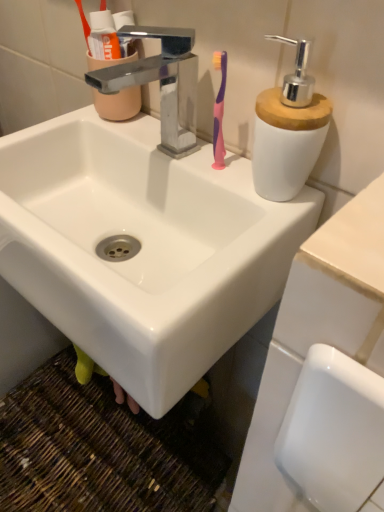
Question: Is satin nickel faucet at center completely or partially inside translucent plastic cup at upper left?

Choices:
 (A) yes
 (B) no

Answer: (B)

Question: From a real-world perspective, is translucent plastic cup at upper left on satin nickel faucet at center?

Choices:
 (A) yes
 (B) no

Answer: (A)

Question: Is translucent plastic cup at upper left completely or partially outside of satin nickel faucet at center?

Choices:
 (A) no
 (B) yes

Answer: (B)

Question: Is translucent plastic cup at upper left beside satin nickel faucet at center?

Choices:
 (A) no
 (B) yes

Answer: (B)

Question: Would you consider translucent plastic cup at upper left to be distant from satin nickel faucet at center?

Choices:
 (A) yes
 (B) no

Answer: (B)

Question: From a real-world perspective, relative to translucent plastic cup at upper left, is white ceramic sink at center vertically above or below?

Choices:
 (A) below
 (B) above

Answer: (A)

Question: Based on their sizes in the image, would you say white ceramic sink at center is bigger or smaller than translucent plastic cup at upper left?

Choices:
 (A) big
 (B) small

Answer: (A)

Question: Considering the relative positions of white ceramic sink at center and translucent plastic cup at upper left in the image provided, is white ceramic sink at center to the left or to the right of translucent plastic cup at upper left?

Choices:
 (A) right
 (B) left

Answer: (A)

Question: Is white ceramic sink at center taller or shorter than translucent plastic cup at upper left?

Choices:
 (A) short
 (B) tall

Answer: (B)

Question: Considering the positions of satin nickel faucet at center and white ceramic sink at center in the image, is satin nickel faucet at center wider or thinner than white ceramic sink at center?

Choices:
 (A) thin
 (B) wide

Answer: (A)

Question: Is satin nickel faucet at center in front of or behind white ceramic sink at center in the image?

Choices:
 (A) behind
 (B) front

Answer: (A)

Question: From their relative heights in the image, would you say satin nickel faucet at center is taller or shorter than white ceramic sink at center?

Choices:
 (A) tall
 (B) short

Answer: (B)

Question: Does point (173, 82) appear closer or farther from the camera than point (1, 259)?

Choices:
 (A) farther
 (B) closer

Answer: (B)

Question: Is translucent plastic cup at upper left inside the boundaries of satin nickel faucet at center, or outside?

Choices:
 (A) inside
 (B) outside

Answer: (B)

Question: Based on their positions, is translucent plastic cup at upper left located to the left or right of satin nickel faucet at center?

Choices:
 (A) right
 (B) left

Answer: (B)